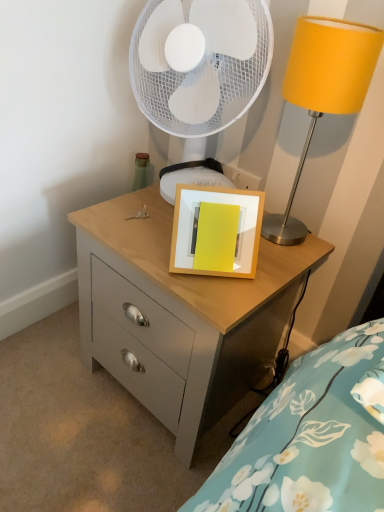
Identify the location of free point in front of metallic yellow lampshade at upper right. Image resolution: width=384 pixels, height=512 pixels. (271, 273).